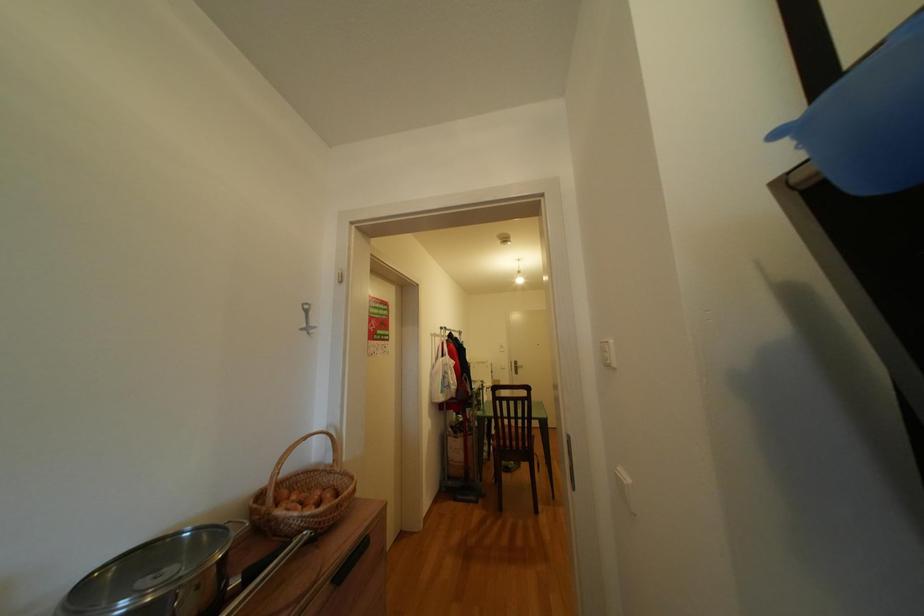
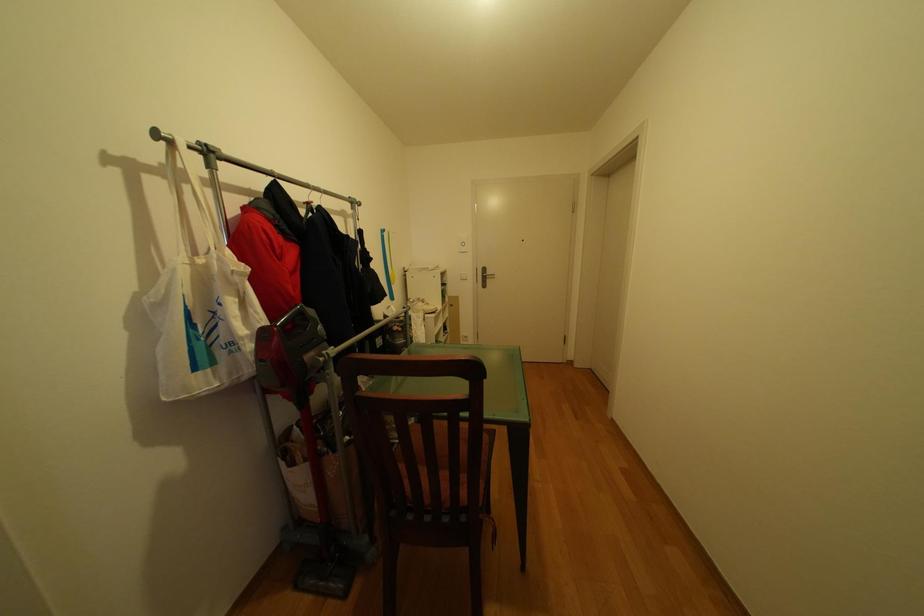
Question: What movement of the cameraman would produce the second image?

Choices:
 (A) Left
 (B) Right
 (C) Forward
 (D) Backward

Answer: (C)